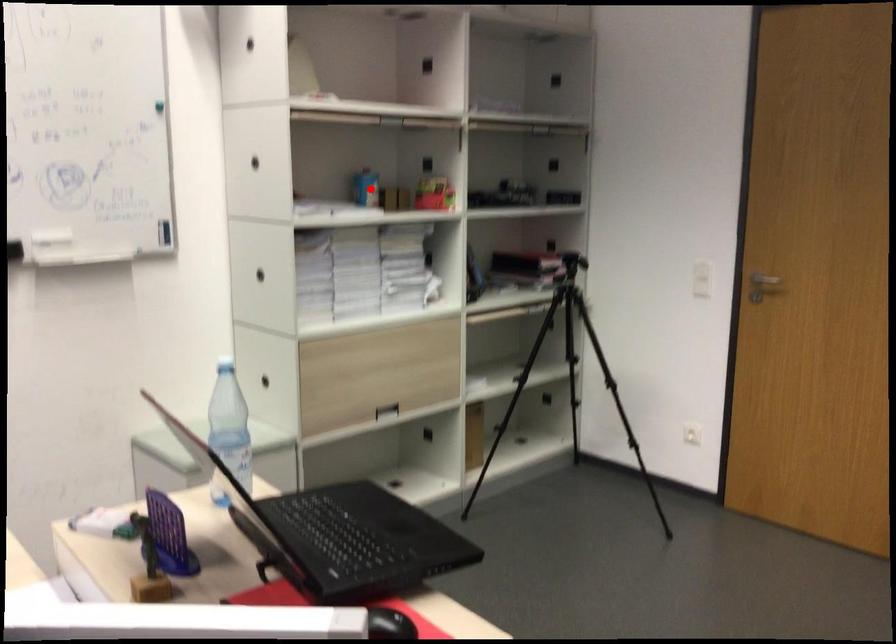
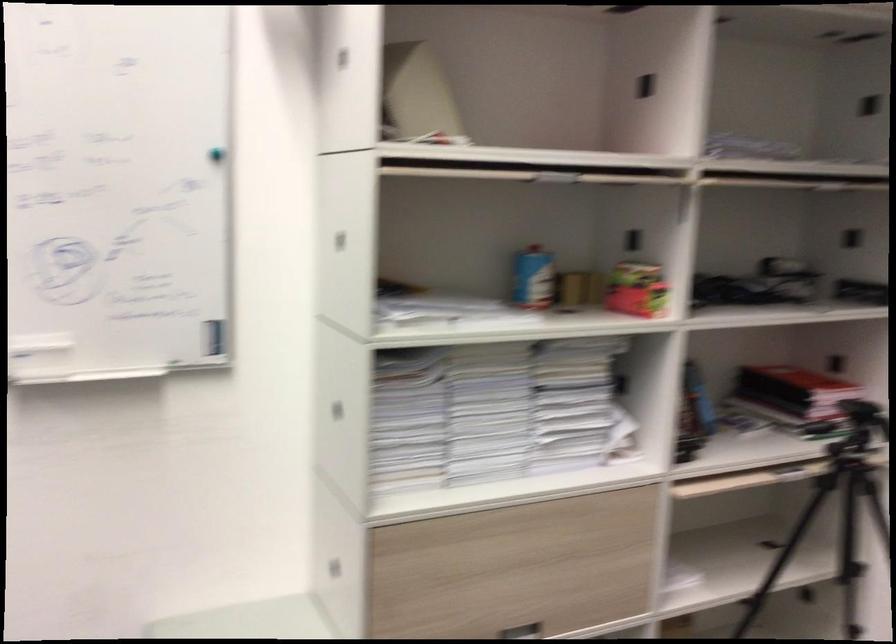
The point at the highlighted location is marked in the first image. Where is the corresponding point in the second image?

(532, 278)